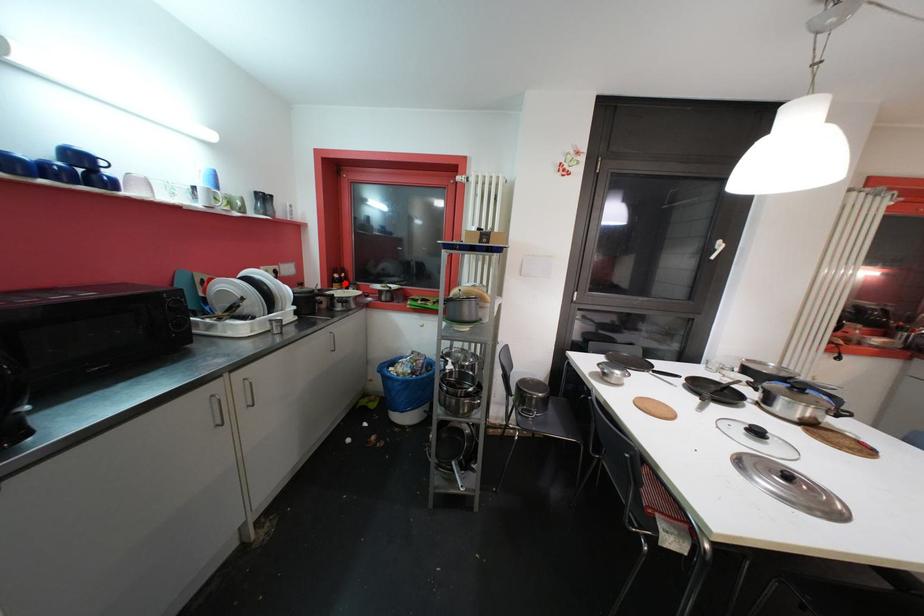
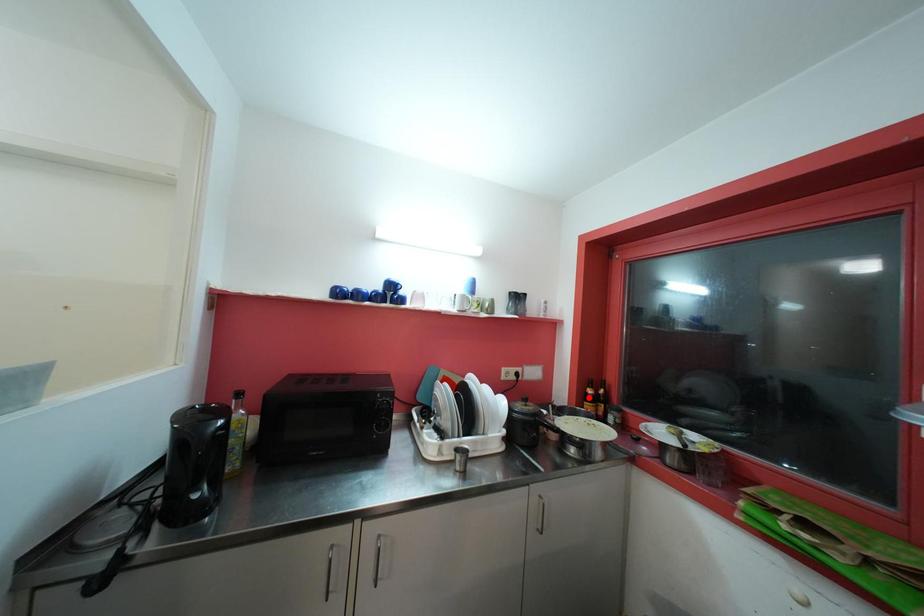
I am providing you with two images of the same scene from different viewpoints. A red point is marked on the first image and another point is marked on the second image. Does the point marked in image1 correspond to the same location as the one in image2?

No